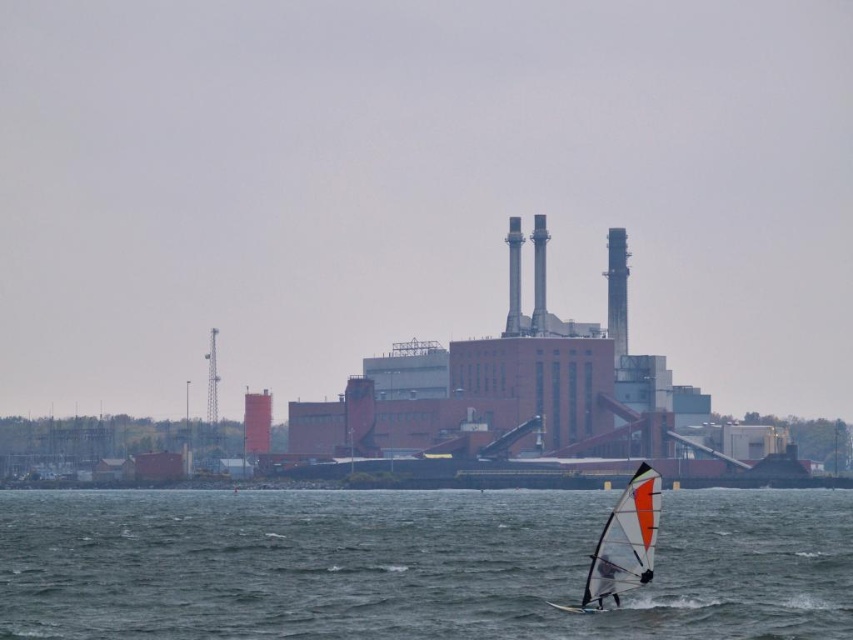
Is white and orange sail at lower center taller than white matte sail at center?

Correct, white and orange sail at lower center is much taller as white matte sail at center.

Who is shorter, white and orange sail at lower center or white matte sail at center?

white matte sail at center is shorter.

Locate an element on the screen. The height and width of the screenshot is (640, 853). white and orange sail at lower center is located at coordinates click(x=624, y=545).

Is point (843, 518) farther from camera compared to point (604, 579)?

Yes, point (843, 518) is behind point (604, 579).

Which of these two, blue water at lower center or white matte sail at center, stands shorter?

Standing shorter between the two is white matte sail at center.

Measure the distance between blue water at lower center and camera.

The distance of blue water at lower center from camera is 647.40 meters.

Where is `blue water at lower center`? The height and width of the screenshot is (640, 853). blue water at lower center is located at coordinates (413, 564).

Is point (100, 531) positioned after point (613, 598)?

Yes, it is behind point (613, 598).

Consider the image. Can you confirm if blue water at lower center is bigger than white and orange sail at lower center?

Yes, blue water at lower center is bigger than white and orange sail at lower center.

You are a GUI agent. You are given a task and a screenshot of the screen. Output one action in this format:
    pyautogui.click(x=<x>, y=<y>)
    Task: Click on the blue water at lower center
    This screenshot has height=640, width=853.
    Given the screenshot: What is the action you would take?
    pyautogui.click(x=413, y=564)